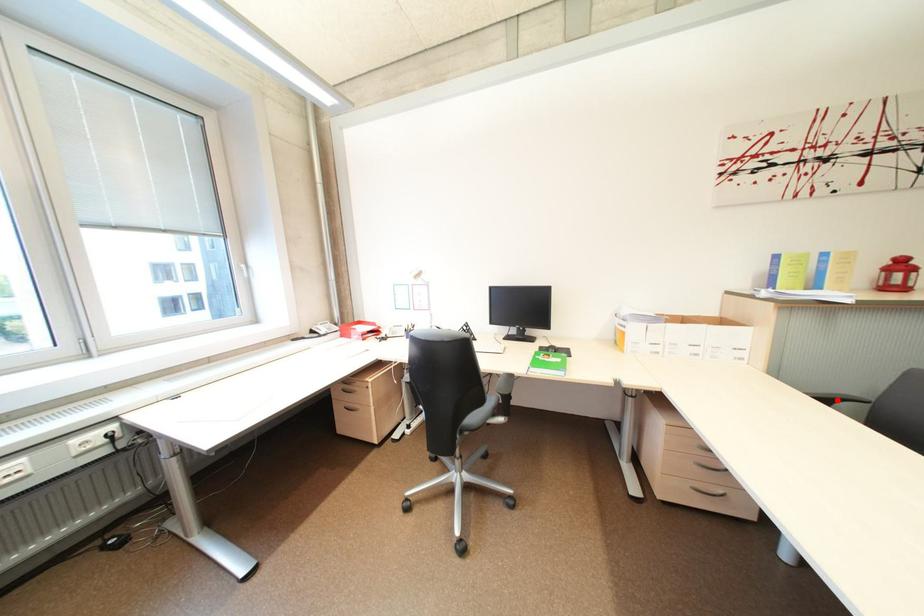
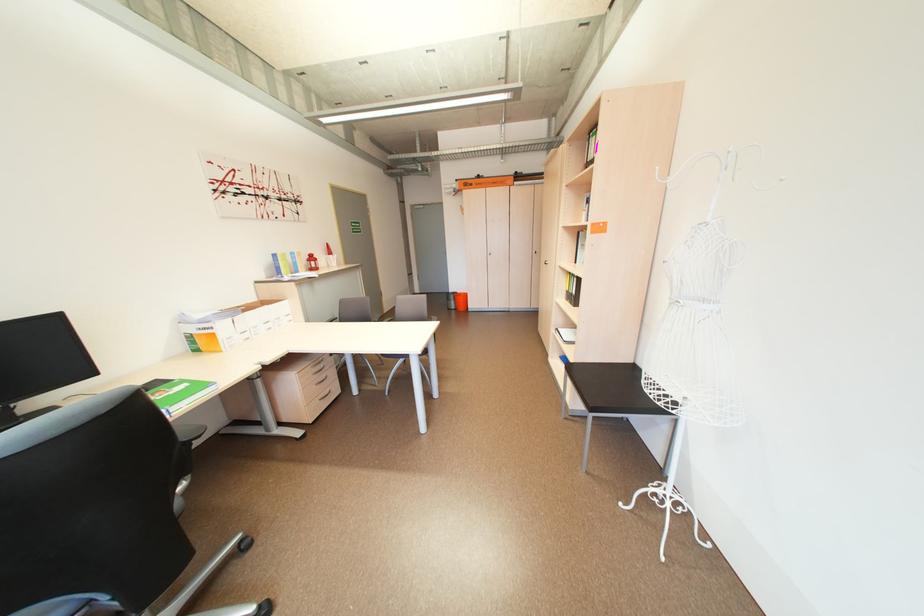
Question: I am providing you with two images of the same scene from different viewpoints. A red point is marked on the first image. At the location where the point appears in image 1, is it still visible in image 2?

Choices:
 (A) Yes
 (B) No

Answer: (B)